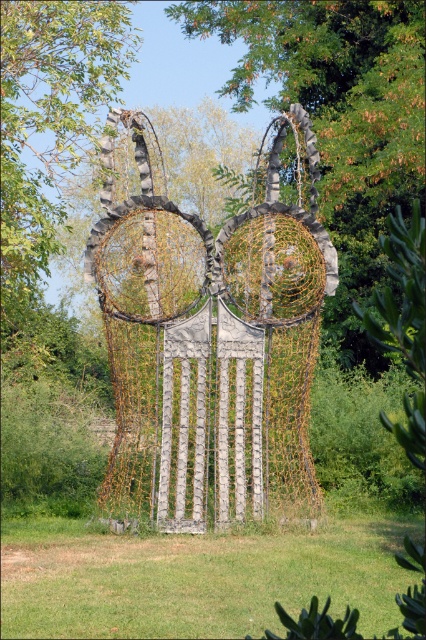
You are standing in the middle of the installation and want to take a photo of both the rusty wire mesh sculpture at center and the green leafy tree at upper center. If your camera can focus on objects within 5 meters, will both be in focus?

The rusty wire mesh sculpture at center is 4.61 meters away from the green leafy tree at upper center. Since your camera can focus within 5 meters, both objects will be in focus as the distance between them is within the camera range.